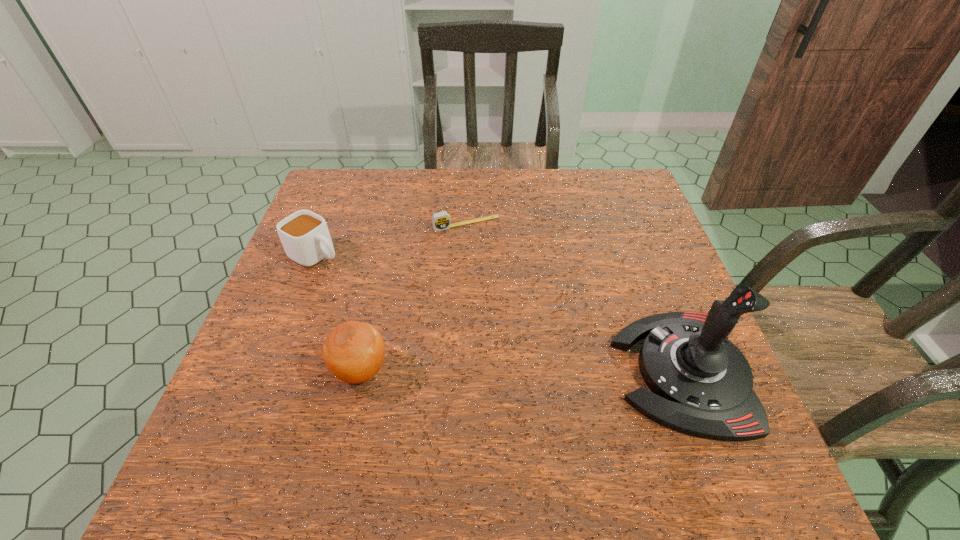
Where is `object positioned at the left edge`? The height and width of the screenshot is (540, 960). object positioned at the left edge is located at coordinates (305, 237).

The height and width of the screenshot is (540, 960). In order to click on object that is positioned at the right edge in this screenshot , I will do `click(701, 383)`.

You are a GUI agent. You are given a task and a screenshot of the screen. Output one action in this format:
    pyautogui.click(x=<x>, y=<y>)
    Task: Click on the object present at the near right corner
    The image size is (960, 540).
    Given the screenshot: What is the action you would take?
    pyautogui.click(x=701, y=383)

The width and height of the screenshot is (960, 540). Identify the location of free space at the far edge of the desktop. (571, 173).

Identify the location of vacant space at the near edge of the desktop. The height and width of the screenshot is (540, 960). (415, 416).

In the image, there is a desktop. Where is `free space at the left edge`? Image resolution: width=960 pixels, height=540 pixels. free space at the left edge is located at coordinates (271, 357).

Find the location of a particular element. vacant area at the right edge of the desktop is located at coordinates (626, 239).

This screenshot has width=960, height=540. In the image, there is a desktop. In order to click on vacant space at the near left corner in this screenshot , I will do (x=265, y=404).

The height and width of the screenshot is (540, 960). In order to click on free region at the far right corner of the desktop in this screenshot , I will do `click(607, 170)`.

Locate an element on the screen. The height and width of the screenshot is (540, 960). free space between the tallest object and the orange is located at coordinates (521, 372).